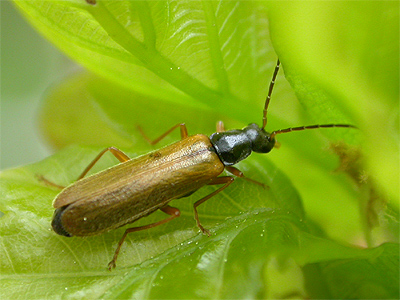
The height and width of the screenshot is (300, 400). Identify the location of right front leg. (221, 184).